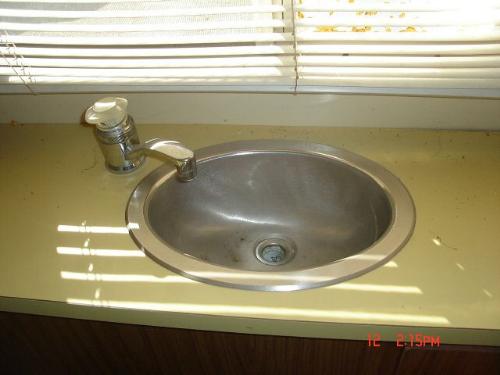
You are a GUI agent. You are given a task and a screenshot of the screen. Output one action in this format:
    pyautogui.click(x=<x>, y=<y>)
    Task: Click on the tap
    This screenshot has width=500, height=375.
    Given the screenshot: What is the action you would take?
    pyautogui.click(x=118, y=155)